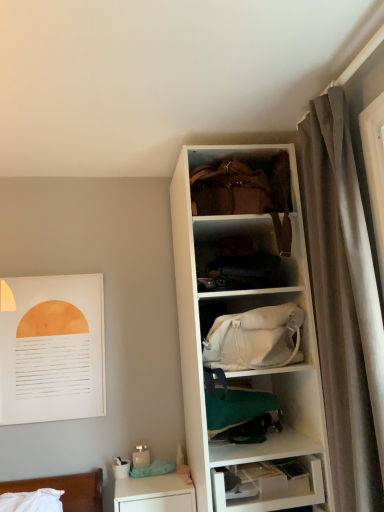
What is the approximate width of velvet gray curtain at right?

The width of velvet gray curtain at right is 6.56 inches.

What is the approximate width of white fabric bag at center, acting as the second shelf starting from the top?

white fabric bag at center, acting as the second shelf starting from the top, is 29.53 centimeters in width.

What do you see at coordinates (255, 339) in the screenshot? I see `white fabric bag at center, which is counted as the third shelf, starting from the bottom` at bounding box center [255, 339].

Find the location of a particular element. green fabric bag at center, the second shelf in the bottom-to-top sequence is located at coordinates (267, 447).

Measure the distance between point (253, 504) and camera.

Point (253, 504) and camera are 5.49 feet apart from each other.

Identify the location of white matte cabinet at center. (241, 187).

Where is `velvet gray curtain at right`? velvet gray curtain at right is located at coordinates [x=343, y=304].

Is the depth of white plastic shelf at lower center, the 1th shelf positioned from the bottom, less than that of matte black clothing at center, acting as the first shelf starting from the top?

Yes, the depth of white plastic shelf at lower center, the 1th shelf positioned from the bottom, is less than that of matte black clothing at center, acting as the first shelf starting from the top.

From a real-world perspective, which object rests below the other?

white plastic shelf at lower center, the fourth shelf when ordered from top to bottom, from a real-world perspective.

Is white plastic shelf at lower center, the 1th shelf positioned from the bottom, aimed at matte black clothing at center, the fourth shelf ordered from the bottom?

No, white plastic shelf at lower center, the 1th shelf positioned from the bottom, is not aimed at matte black clothing at center, the fourth shelf ordered from the bottom.

Which object is thinner, white plastic shelf at lower center, the fourth shelf when ordered from top to bottom, or matte black clothing at center, the fourth shelf ordered from the bottom?

matte black clothing at center, the fourth shelf ordered from the bottom.

Is velvet gray curtain at right oriented away from white fabric bag at center, which is counted as the third shelf, starting from the bottom?

No, velvet gray curtain at right's orientation is not away from white fabric bag at center, which is counted as the third shelf, starting from the bottom.

Consider the image. Which of these two, velvet gray curtain at right or white fabric bag at center, acting as the second shelf starting from the top, is bigger?

velvet gray curtain at right is bigger.

Looking at this image, from the image's perspective, which is above, velvet gray curtain at right or white fabric bag at center, which is counted as the third shelf, starting from the bottom?

velvet gray curtain at right, from the image's perspective.

Is velvet gray curtain at right wider or thinner than white fabric bag at center, acting as the second shelf starting from the top?

velvet gray curtain at right is thinner than white fabric bag at center, acting as the second shelf starting from the top.

Is velvet gray curtain at right thinner than white plastic shelf at lower center, the fourth shelf when ordered from top to bottom?

Yes, velvet gray curtain at right is thinner than white plastic shelf at lower center, the fourth shelf when ordered from top to bottom.

Can you confirm if velvet gray curtain at right is shorter than white plastic shelf at lower center, the fourth shelf when ordered from top to bottom?

No.

Between point (345, 251) and point (317, 497), which one is positioned in front?

The point (345, 251) is closer to the camera.

Consider the image. Can we say velvet gray curtain at right lies outside white glossy table at lower left?

Yes, velvet gray curtain at right is not within white glossy table at lower left.

Considering the positions of objects velvet gray curtain at right and white glossy table at lower left in the image provided, who is more to the left, velvet gray curtain at right or white glossy table at lower left?

white glossy table at lower left is more to the left.

From a real-world perspective, is velvet gray curtain at right physically above white glossy table at lower left?

Yes, from a real-world perspective, velvet gray curtain at right is above white glossy table at lower left.

Considering the relative sizes of velvet gray curtain at right and white glossy table at lower left in the image provided, is velvet gray curtain at right thinner than white glossy table at lower left?

Correct, the width of velvet gray curtain at right is less than that of white glossy table at lower left.

Is the position of velvet gray curtain at right more distant than that of white matte cabinet at center?

That is False.

Does velvet gray curtain at right appear on the right side of white matte cabinet at center?

Yes.

From the image's perspective, is velvet gray curtain at right under white matte cabinet at center?

Correct, velvet gray curtain at right appears lower than white matte cabinet at center in the image.

From the picture: Is velvet gray curtain at right next to white matte cabinet at center and touching it?

velvet gray curtain at right and white matte cabinet at center are not in contact.

Could white fabric bag at center, acting as the second shelf starting from the top, be considered to be inside white matte cabinet at center?

No, white matte cabinet at center does not contain white fabric bag at center, acting as the second shelf starting from the top.

Considering the sizes of objects white matte cabinet at center and white fabric bag at center, which is counted as the third shelf, starting from the bottom, in the image provided, who is taller, white matte cabinet at center or white fabric bag at center, which is counted as the third shelf, starting from the bottom,?

white matte cabinet at center.

Can you confirm if white matte cabinet at center is wider than white fabric bag at center, which is counted as the third shelf, starting from the bottom?

No.

From the image's perspective, which is below, white matte cabinet at center or white fabric bag at center, which is counted as the third shelf, starting from the bottom?

white fabric bag at center, which is counted as the third shelf, starting from the bottom, is shown below in the image.

Would you say green fabric bag at center, the second shelf in the bottom-to-top sequence, is inside or outside white paper at upper left?

green fabric bag at center, the second shelf in the bottom-to-top sequence, is not enclosed by white paper at upper left.

Looking at this image, is green fabric bag at center, the 3th shelf from the top, bigger than white paper at upper left?

Actually, green fabric bag at center, the 3th shelf from the top, might be smaller than white paper at upper left.

Which is more to the right, green fabric bag at center, the 3th shelf from the top, or white paper at upper left?

Positioned to the right is green fabric bag at center, the 3th shelf from the top.

From a real-world perspective, is green fabric bag at center, the 3th shelf from the top, positioned over white paper at upper left based on gravity?

No, from a real-world perspective, green fabric bag at center, the 3th shelf from the top, is not over white paper at upper left

Find the location of `the 3rd shelf located above the white plastic shelf at lower center, the 1th shelf positioned from the bottom (from a real-world perspective)`. the 3rd shelf located above the white plastic shelf at lower center, the 1th shelf positioned from the bottom (from a real-world perspective) is located at coordinates (244, 256).

From the velvet gray curtain at right, count the 2nd shelf to the left and point to it. Please provide its 2D coordinates.

[(255, 339)]

Considering their positions, is white fabric bag at center, which is counted as the third shelf, starting from the bottom, positioned further to white matte cabinet at center than white paper at upper left?

white paper at upper left.

Based on their spatial positions, is white matte cabinet at center or matte black clothing at center, the fourth shelf ordered from the bottom, further from green fabric bag at center, the 3th shelf from the top?

white matte cabinet at center is further to green fabric bag at center, the 3th shelf from the top.

In the scene shown: Based on their spatial positions, is white fabric bag at center, acting as the second shelf starting from the top, or green fabric bag at center, the second shelf in the bottom-to-top sequence, closer to velvet gray curtain at right?

white fabric bag at center, acting as the second shelf starting from the top, is positioned closer to the anchor velvet gray curtain at right.

Considering their positions, is velvet gray curtain at right positioned further to matte black clothing at center, the fourth shelf ordered from the bottom, than white matte cabinet at center?

velvet gray curtain at right is positioned further to the anchor matte black clothing at center, the fourth shelf ordered from the bottom.

Estimate the real-world distances between objects in this image. Which object is further from white fabric bag at center, which is counted as the third shelf, starting from the bottom, white matte cabinet at center or matte black clothing at center, the fourth shelf ordered from the bottom?

The object further to white fabric bag at center, which is counted as the third shelf, starting from the bottom, is white matte cabinet at center.

Looking at the image, which one is located further to white fabric bag at center, which is counted as the third shelf, starting from the bottom, white glossy table at lower left or white matte cabinet at center?

white glossy table at lower left is positioned further to the anchor white fabric bag at center, which is counted as the third shelf, starting from the bottom.

Looking at the image, which one is located closer to white glossy table at lower left, white plastic shelf at lower center, the fourth shelf when ordered from top to bottom, or white fabric bag at center, acting as the second shelf starting from the top?

white plastic shelf at lower center, the fourth shelf when ordered from top to bottom.

From the image, which object appears to be farther from velvet gray curtain at right, white paper at upper left or white glossy table at lower left?

Among the two, white paper at upper left is located further to velvet gray curtain at right.

Image resolution: width=384 pixels, height=512 pixels. I want to click on table located between white paper at upper left and white plastic shelf at lower center, the 1th shelf positioned from the bottom, in the left-right direction, so click(154, 494).

Identify the location of shelf between white fabric bag at center, which is counted as the third shelf, starting from the bottom, and white plastic shelf at lower center, the 1th shelf positioned from the bottom, from top to bottom. Image resolution: width=384 pixels, height=512 pixels. (267, 447).

The width and height of the screenshot is (384, 512). I want to click on picture frame that lies between matte black clothing at center, the fourth shelf ordered from the bottom, and white glossy table at lower left from top to bottom, so click(x=52, y=348).

You are a GUI agent. You are given a task and a screenshot of the screen. Output one action in this format:
    pyautogui.click(x=<x>, y=<y>)
    Task: Click on the picture frame between white matte cabinet at center and white glossy table at lower left from top to bottom
    The height and width of the screenshot is (512, 384).
    Given the screenshot: What is the action you would take?
    pyautogui.click(x=52, y=348)